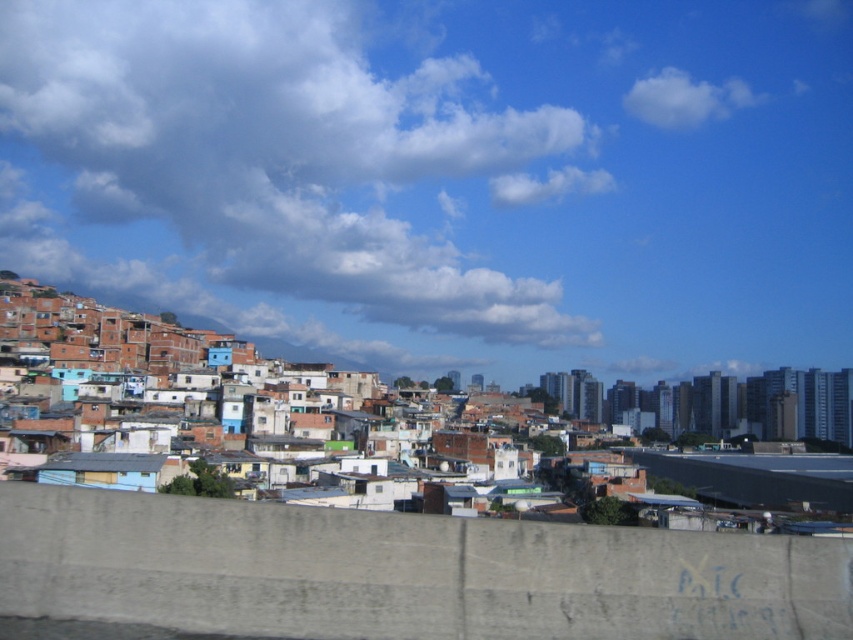
From the picture: You are standing at the viewpoint of the image and looking towards the point marked as point (271, 164). What is the most likely object or area that this point is pointing to?

The point (271, 164) is pointing to the cloudy sky at upper center.

You are an architect designing a new solar panel installation for the rooftops of the buildings in the urban area shown. Considering the cloudy sky at upper center and the white fluffy cloud at upper right, which object might cast a shadow over the solar panels more frequently or for longer durations?

The cloudy sky at upper center is taller than the white fluffy cloud at upper right, so it might cast a shadow over the solar panels more frequently or for longer durations because its greater height allows it to block sunlight for longer periods.